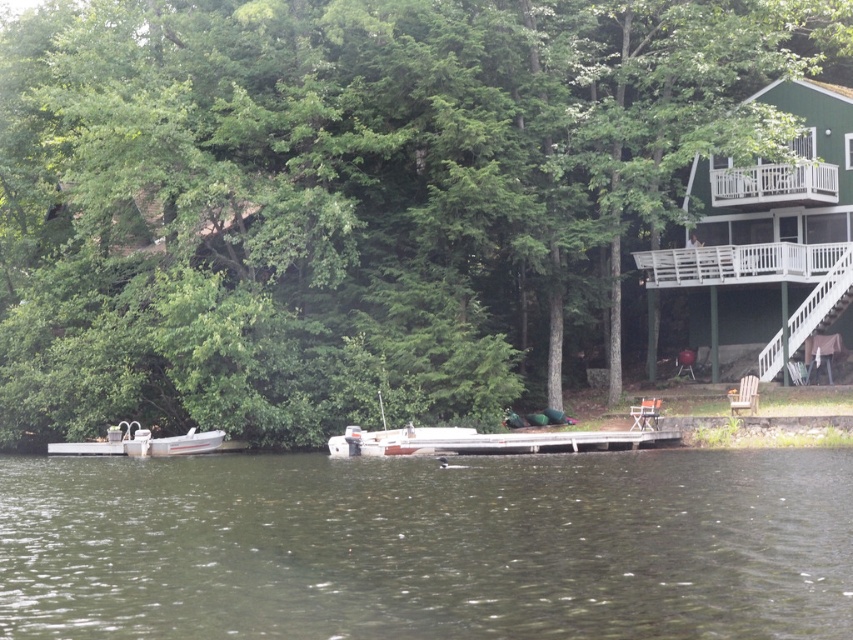
You are standing on the wooden pier and want to see the white plastic boat at lower left. Is the green leafy tree at center blocking your view of it?

The green leafy tree at center is in front of the white plastic boat at lower left, so it is blocking the view of the white plastic boat at lower left.

You are a photographer planning to capture the reflection of the green leafy tree at center in the greenish water at center. Based on the scene, will the tree be visible in the water?

The green leafy tree at center is located above greenish water at center, so its reflection should be visible in the water since it is positioned above the water surface.

In the scene shown: You are standing on the wooden pier and want to look towards the house. Which object, the green leafy tree at center or the greenish water at center, would be to your left?

The green leafy tree at center is positioned on the right side of greenish water at center. Since you are facing the house, the greenish water at center would be to your left and the green leafy tree at center to your right.